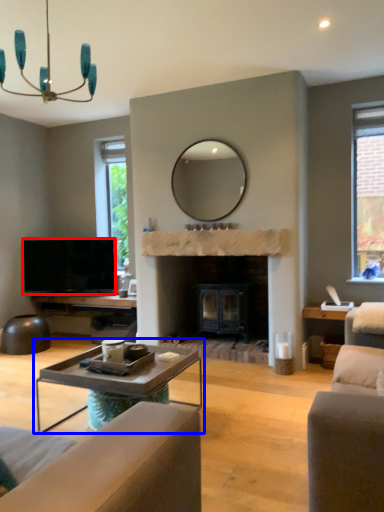
Question: Which of the following is the closest to the observer, television (highlighted by a red box) or coffee table (highlighted by a blue box)?

Choices:
 (A) television
 (B) coffee table

Answer: (B)